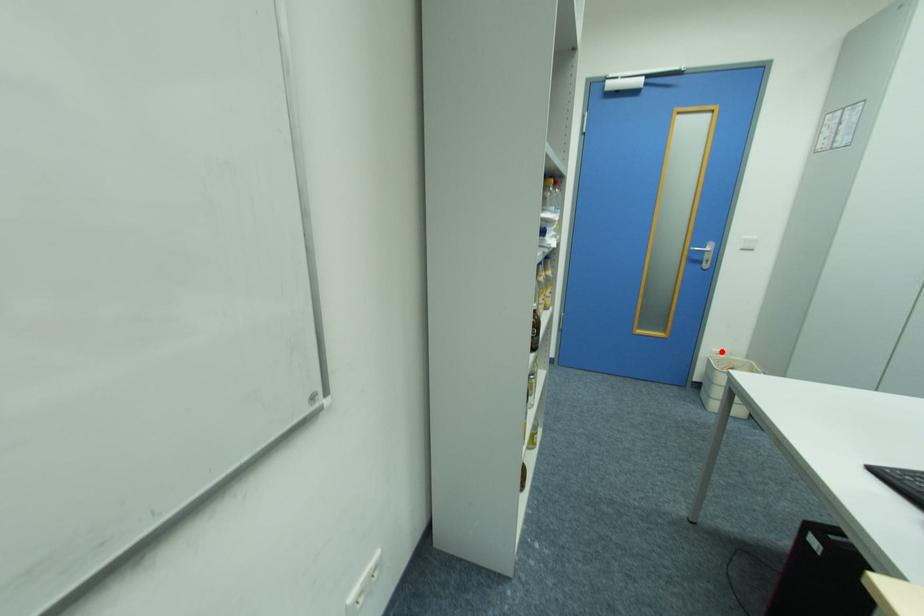
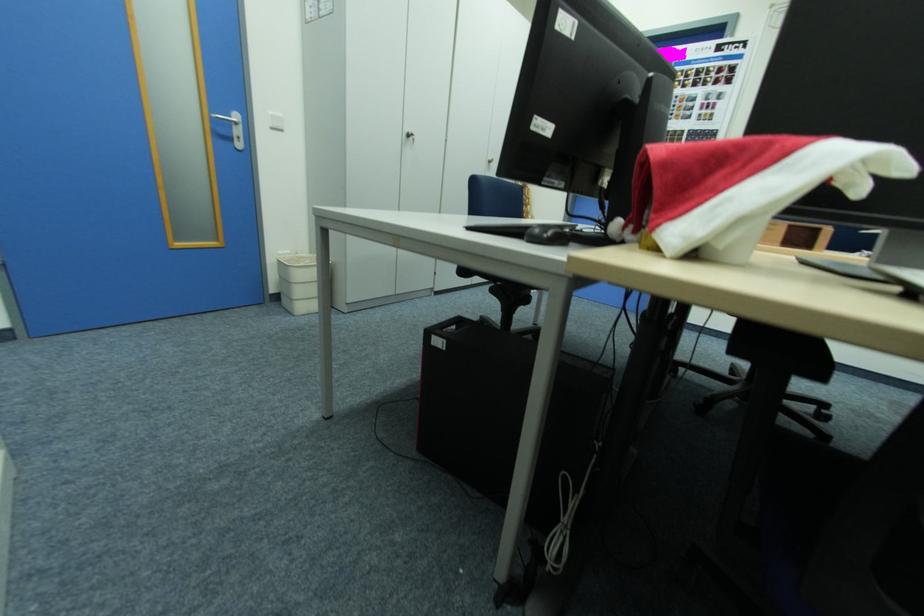
Question: I am providing you with two images of the same scene from different viewpoints. Image1 has a red point marked. In image2, the corresponding 3D location appears at what relative position? Reply with the corresponding letter.

Choices:
 (A) Closer
 (B) Farther

Answer: (B)